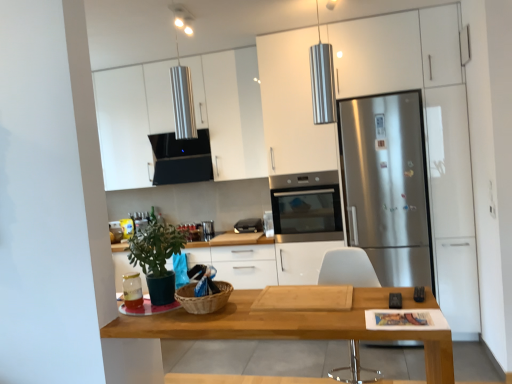
Where is `vacant space behind black plastic remote control at lower center, marked as the 1th appliance in a front-to-back arrangement`? This screenshot has height=384, width=512. vacant space behind black plastic remote control at lower center, marked as the 1th appliance in a front-to-back arrangement is located at coordinates (392, 294).